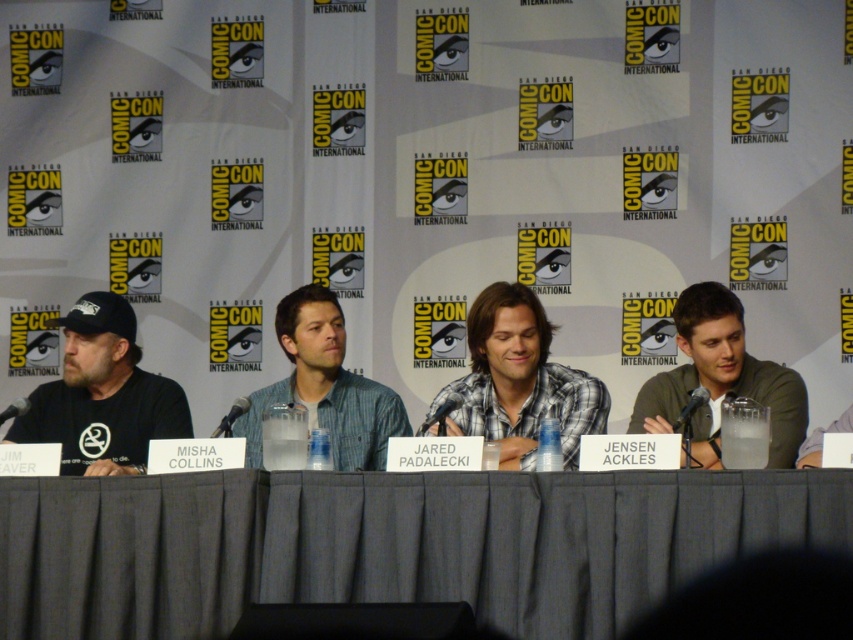
Does gray fabric table at center appear under checkered fabric shirt at center?

Yes.

I want to click on gray fabric table at center, so click(x=387, y=545).

Which of these two, black t-shirt at left or checkered fabric shirt at center, stands taller?

With more height is black t-shirt at left.

Between black t-shirt at left and checkered fabric shirt at center, which one appears on the left side from the viewer's perspective?

black t-shirt at left

Between point (108, 458) and point (582, 424), which one is positioned behind?

Positioned behind is point (108, 458).

Where is `black t-shirt at left`? The height and width of the screenshot is (640, 853). black t-shirt at left is located at coordinates (102, 396).

Does point (511, 429) come closer to viewer compared to point (380, 400)?

Yes, it is.

Is checkered fabric shirt at center shorter than blue denim shirt at center?

Correct, checkered fabric shirt at center is not as tall as blue denim shirt at center.

Find the location of a particular element. checkered fabric shirt at center is located at coordinates (520, 381).